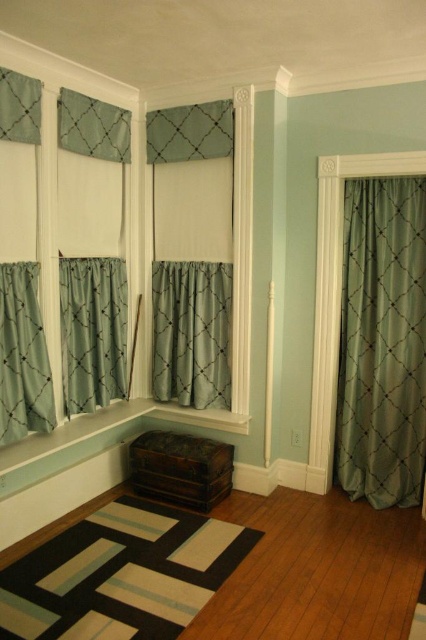
Question: Which of the following is the farthest from the observer?

Choices:
 (A) satin teal curtain at center
 (B) matte teal curtain at center
 (C) matte teal curtain at upper left

Answer: (B)

Question: Among these objects, which one is farthest from the camera?

Choices:
 (A) satin teal curtain at center
 (B) green silk curtain at right
 (C) teal fabric curtain at left

Answer: (A)

Question: Which point is farther to the camera?

Choices:
 (A) (20, 275)
 (B) (60, 348)

Answer: (B)

Question: Does green silk curtain at right appear on the left side of satin teal curtain at center?

Choices:
 (A) no
 (B) yes

Answer: (A)

Question: Is matte teal curtain at upper left positioned behind matte teal curtain at center?

Choices:
 (A) yes
 (B) no

Answer: (B)

Question: Does green silk curtain at right lie behind teal fabric curtain at left?

Choices:
 (A) yes
 (B) no

Answer: (A)